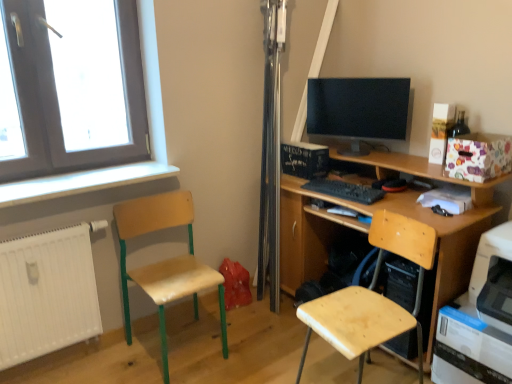
Identify the location of vacant space underneath matte black monitor at center (from a real-world perspective). This screenshot has height=384, width=512. (373, 154).